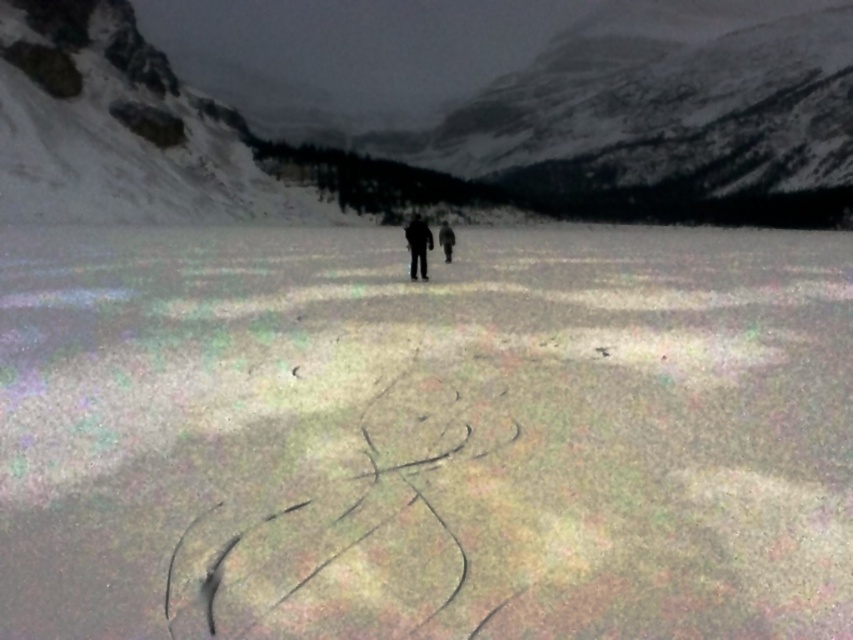
You are planning to build a snowman using the white textured snow at center and the snowy granite mountain at upper center. Which object provides more horizontal space for the base of the snowman?

The snowy granite mountain at upper center provides more horizontal space for the base of the snowman because it has a greater width than the white textured snow at center.

You are standing at the point marked as point (425, 433) in the snowy landscape. Looking around, you see white textured snow at center. What is directly beneath your feet?

The point marked as point (425, 433) is where the white textured snow at center is located, so the ground beneath your feet is white textured snow at center.

You are planning to take a photo of the white textured snow at center and the black matte jacket at center. Which object should you focus on to ensure both are in the frame without needing to adjust the camera angle?

The white textured snow at center is larger in size than the black matte jacket at center, so focusing on the white textured snow at center will ensure both objects remain within the frame without needing to adjust the camera angle since it occupies more space.